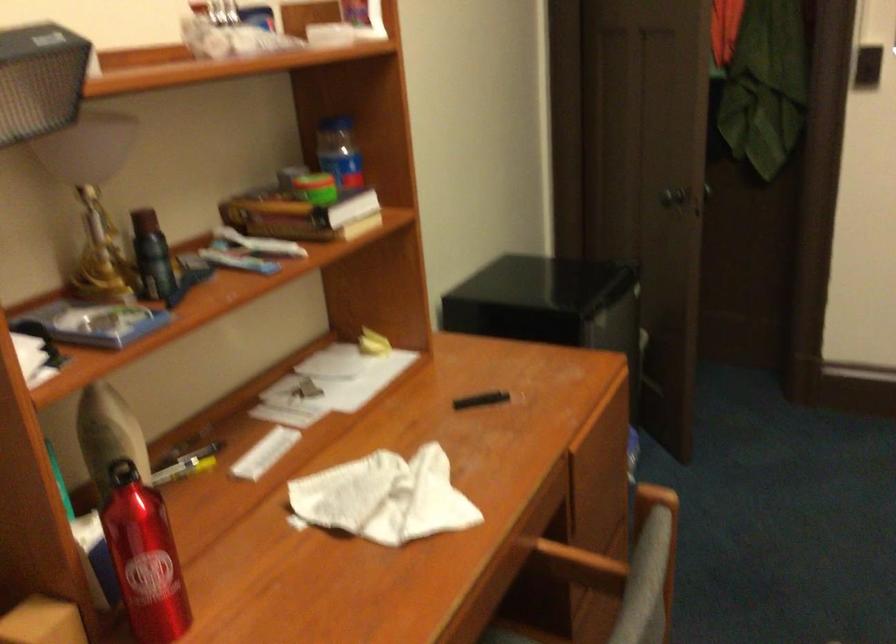
The image size is (896, 644). What do you see at coordinates (480, 400) in the screenshot?
I see `the black marker` at bounding box center [480, 400].